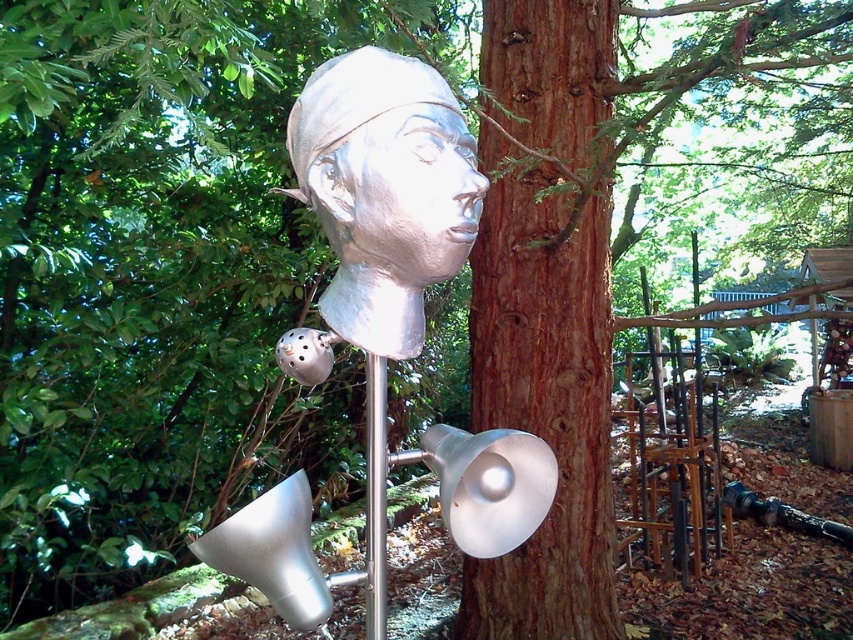
Is point (463, 145) farther from viewer compared to point (378, 470)?

No, (463, 145) is in front of (378, 470).

Describe the element at coordinates (412, 193) in the screenshot. I see `satin silver sculpture at center` at that location.

In order to click on satin silver sculpture at center in this screenshot , I will do `click(412, 193)`.

Can you confirm if brown rough bark at center is shorter than satin silver head at center?

No, brown rough bark at center is not shorter than satin silver head at center.

What do you see at coordinates (546, 308) in the screenshot? I see `brown rough bark at center` at bounding box center [546, 308].

At what (x,y) coordinates should I click in order to perform the action: click on brown rough bark at center. Please return your answer as a coordinate pair (x, y). Image resolution: width=853 pixels, height=640 pixels. Looking at the image, I should click on (546, 308).

Can you confirm if satin silver head at center is taller than silver metallic pole at center?

Yes, satin silver head at center is taller than silver metallic pole at center.

In order to click on satin silver head at center in this screenshot , I will do `click(384, 189)`.

You are a GUI agent. You are given a task and a screenshot of the screen. Output one action in this format:
    pyautogui.click(x=<x>, y=<y>)
    Task: Click on the satin silver head at center
    
    Given the screenshot: What is the action you would take?
    click(x=384, y=189)

Identify the location of satin silver head at center. (384, 189).